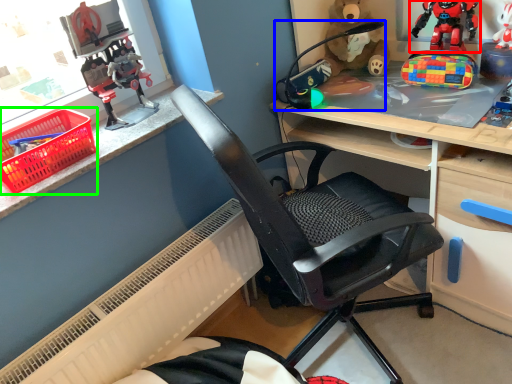
Question: Estimate the real-world distances between objects in this image. Which object is farther from toy (highlighted by a red box), toy (highlighted by a blue box) or basket (highlighted by a green box)?

Choices:
 (A) toy
 (B) basket

Answer: (B)